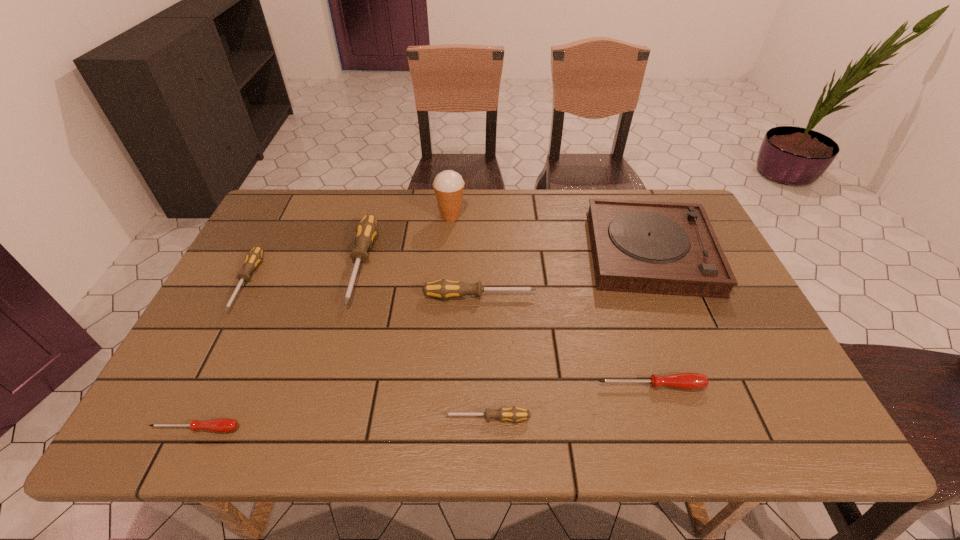
At what (x,y) coordinates should I click in order to perform the action: click on the left red screwdriver. Please return your answer as a coordinate pair (x, y). Looking at the image, I should click on (222, 425).

Where is `the smaller red screwdriver`? This screenshot has width=960, height=540. the smaller red screwdriver is located at coordinates (222, 425).

This screenshot has height=540, width=960. In order to click on vacant space located 0.160m on the front of the icecream in this screenshot , I will do `click(447, 260)`.

This screenshot has height=540, width=960. I want to click on free location located 0.210m on the left of the phonograph record, so click(516, 252).

The height and width of the screenshot is (540, 960). What are the coordinates of `free point located at the tip of the third gray screwdriver from right to left` in the screenshot? It's located at (344, 328).

This screenshot has width=960, height=540. In order to click on free location located 0.120m at the tip of the fifth shortest screwdriver in this screenshot , I will do `click(582, 296)`.

This screenshot has width=960, height=540. I want to click on vacant space located at the tip of the third biggest gray screwdriver, so click(204, 363).

Where is `free space located on the right of the third nearest object`? Image resolution: width=960 pixels, height=540 pixels. free space located on the right of the third nearest object is located at coordinates (785, 386).

At what (x,y) coordinates should I click in order to perform the action: click on vacant area situated at the tip of the smallest gray screwdriver. Please return your answer as a coordinate pair (x, y). The width and height of the screenshot is (960, 540). Looking at the image, I should click on (363, 418).

You are a GUI agent. You are given a task and a screenshot of the screen. Output one action in this format:
    pyautogui.click(x=<x>, y=<y>)
    Task: Click on the free region located at the tip of the smallest gray screwdriver
    The height and width of the screenshot is (540, 960).
    Given the screenshot: What is the action you would take?
    pyautogui.click(x=311, y=418)